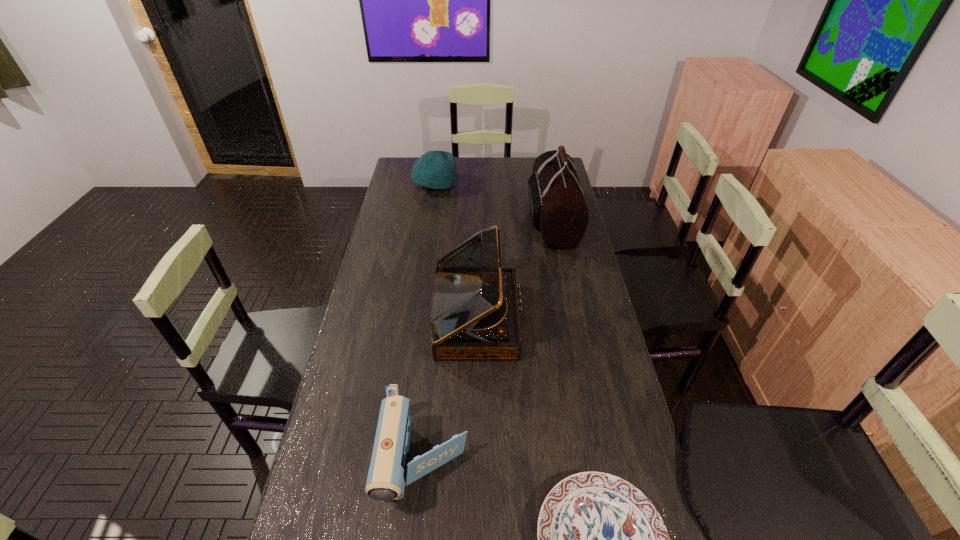
Locate an element on the screen. object at the far edge is located at coordinates (435, 169).

At what (x,y) coordinates should I click in order to perform the action: click on beanie positioned at the left edge. Please return your answer as a coordinate pair (x, y). Looking at the image, I should click on (435, 169).

What are the coordinates of `camcorder located at the left edge` in the screenshot? It's located at (389, 471).

This screenshot has height=540, width=960. I want to click on object located in the right edge section of the desktop, so click(559, 211).

Image resolution: width=960 pixels, height=540 pixels. In order to click on object that is at the far left corner in this screenshot , I will do `click(435, 169)`.

At what (x,y) coordinates should I click in order to perform the action: click on vacant position at the far edge of the desktop. Please return your answer as a coordinate pair (x, y). Looking at the image, I should click on (503, 165).

Find the location of a particular element. vacant space at the left edge of the desktop is located at coordinates (401, 189).

Identify the location of free location at the right edge. This screenshot has height=540, width=960. (571, 252).

At what (x,y) coordinates should I click in order to perform the action: click on unoccupied area between the camcorder and the third nearest object. Please return your answer as a coordinate pair (x, y). This screenshot has width=960, height=540. Looking at the image, I should click on (451, 390).

At what (x,y) coordinates should I click in order to perform the action: click on free space between the second tallest object and the camcorder. Please return your answer as a coordinate pair (x, y). Image resolution: width=960 pixels, height=540 pixels. Looking at the image, I should click on (451, 390).